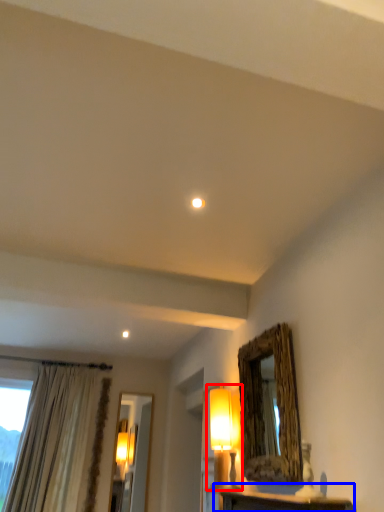
Question: Which of the following is the closest to the observer, table lamp (highlighted by a red box) or table (highlighted by a blue box)?

Choices:
 (A) table lamp
 (B) table

Answer: (B)